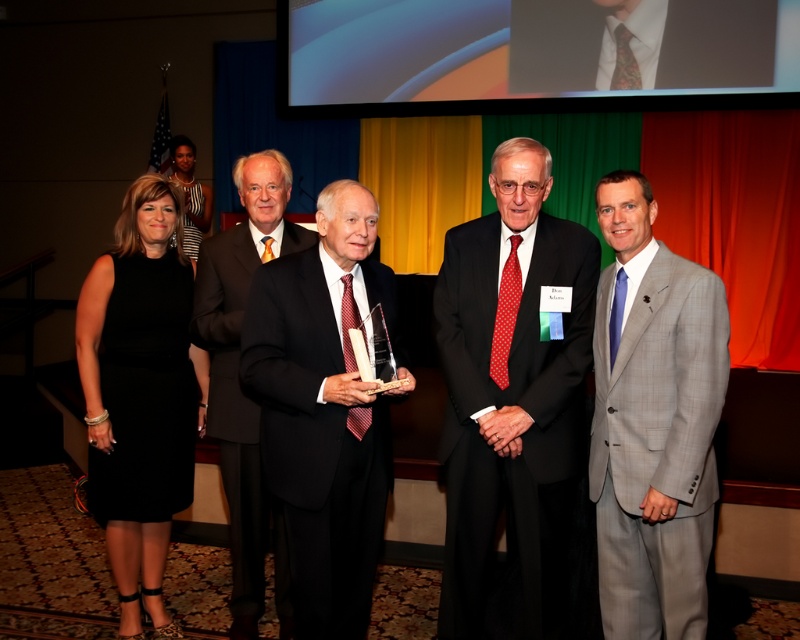
Is polished black suit at center above dark suit at center?

Actually, polished black suit at center is below dark suit at center.

Which is more to the right, polished black suit at center or dark suit at center?

Positioned to the right is polished black suit at center.

Identify the location of polished black suit at center. (512, 403).

How far apart are gray checkered suit at right and matte black suit at center?

gray checkered suit at right is 1.31 meters away from matte black suit at center.

Is gray checkered suit at right thinner than matte black suit at center?

Yes.

Locate an element on the screen. Image resolution: width=800 pixels, height=640 pixels. gray checkered suit at right is located at coordinates (654, 420).

You are a GUI agent. You are given a task and a screenshot of the screen. Output one action in this format:
    pyautogui.click(x=<x>, y=<y>)
    Task: Click on the gray checkered suit at right
    The image size is (800, 640).
    Given the screenshot: What is the action you would take?
    pyautogui.click(x=654, y=420)

Is gray checkered suit at right positioned before dark suit at center?

Yes.

Which is more to the left, gray checkered suit at right or dark suit at center?

Positioned to the left is dark suit at center.

This screenshot has height=640, width=800. What do you see at coordinates (654, 420) in the screenshot? I see `gray checkered suit at right` at bounding box center [654, 420].

You are a GUI agent. You are given a task and a screenshot of the screen. Output one action in this format:
    pyautogui.click(x=<x>, y=<y>)
    Task: Click on the gray checkered suit at right
    The image size is (800, 640).
    Given the screenshot: What is the action you would take?
    tap(654, 420)